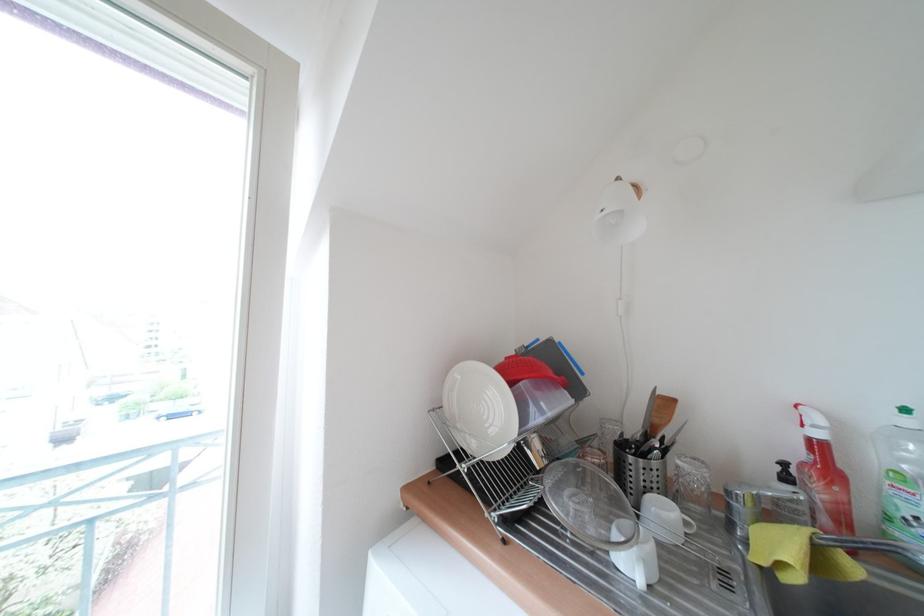
This screenshot has height=616, width=924. Describe the element at coordinates (659, 413) in the screenshot. I see `the wooden knife handle` at that location.